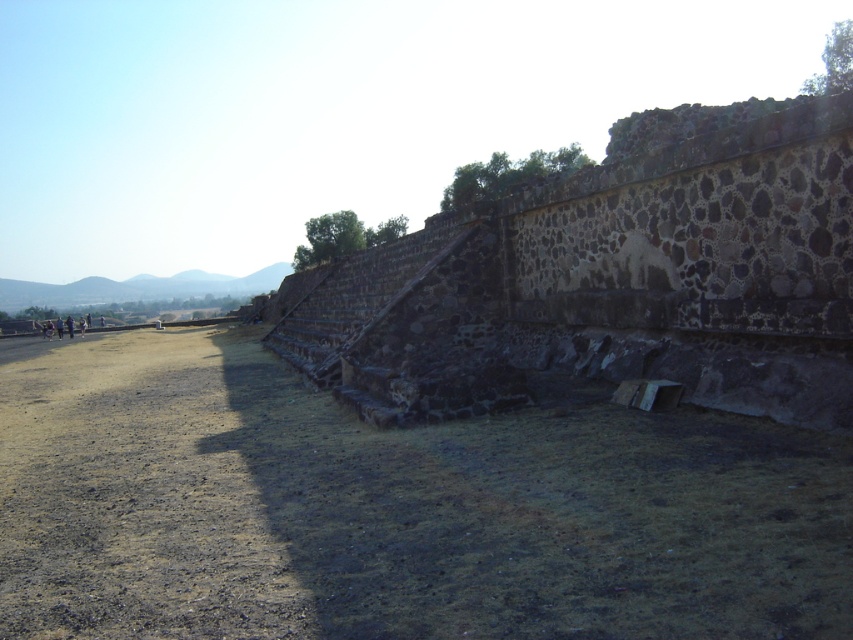
Consider the image. Is brown/dry soil at center thinner than brown dirt track at lower left?

Yes, brown/dry soil at center is thinner than brown dirt track at lower left.

Which is below, brown/dry soil at center or brown dirt track at lower left?

brown dirt track at lower left is lower down.

Describe the element at coordinates (393, 508) in the screenshot. I see `brown/dry soil at center` at that location.

Where is `brown/dry soil at center`? Image resolution: width=853 pixels, height=640 pixels. brown/dry soil at center is located at coordinates (393, 508).

The height and width of the screenshot is (640, 853). What do you see at coordinates (393, 508) in the screenshot?
I see `brown/dry soil at center` at bounding box center [393, 508].

Which of these two, brown/dry soil at center or rustic stone stairs at center, stands shorter?

brown/dry soil at center

At what (x,y) coordinates should I click in order to perform the action: click on brown/dry soil at center. Please return your answer as a coordinate pair (x, y). The image size is (853, 640). Looking at the image, I should click on (393, 508).

Can you confirm if rustic stone stairs at center is positioned to the left of brown dirt track at lower left?

Incorrect, rustic stone stairs at center is not on the left side of brown dirt track at lower left.

Can you confirm if rustic stone stairs at center is smaller than brown dirt track at lower left?

Actually, rustic stone stairs at center might be larger than brown dirt track at lower left.

Does point (750, 148) come behind point (7, 412)?

No, (750, 148) is closer to viewer.

Locate an element on the screen. rustic stone stairs at center is located at coordinates (608, 284).